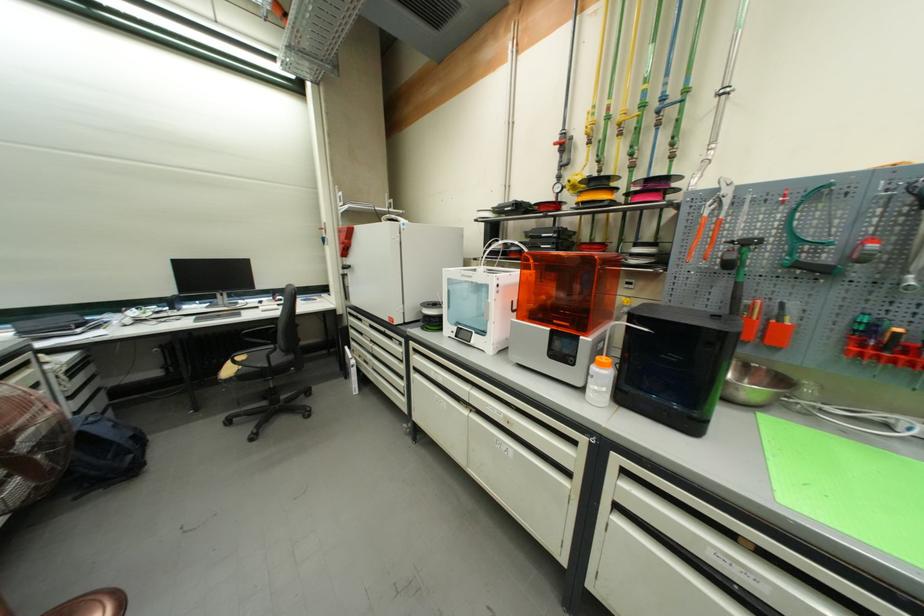
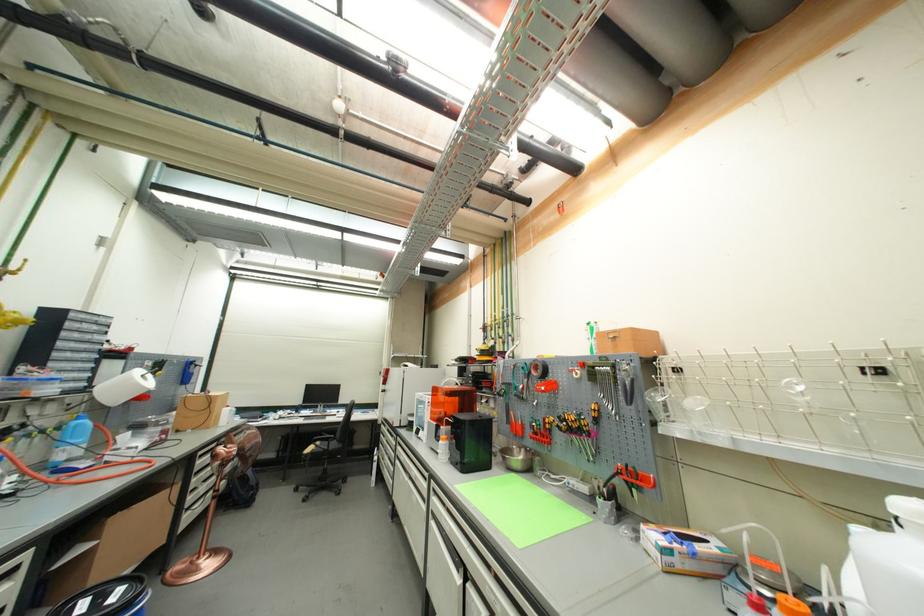
Find the pixel in the second image that matches [265,304] in the first image.

(344, 413)